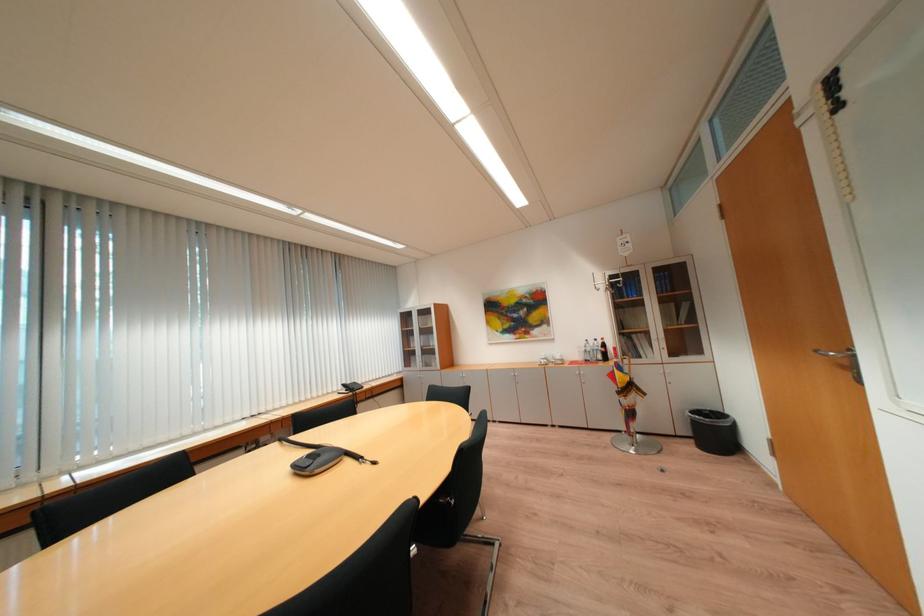
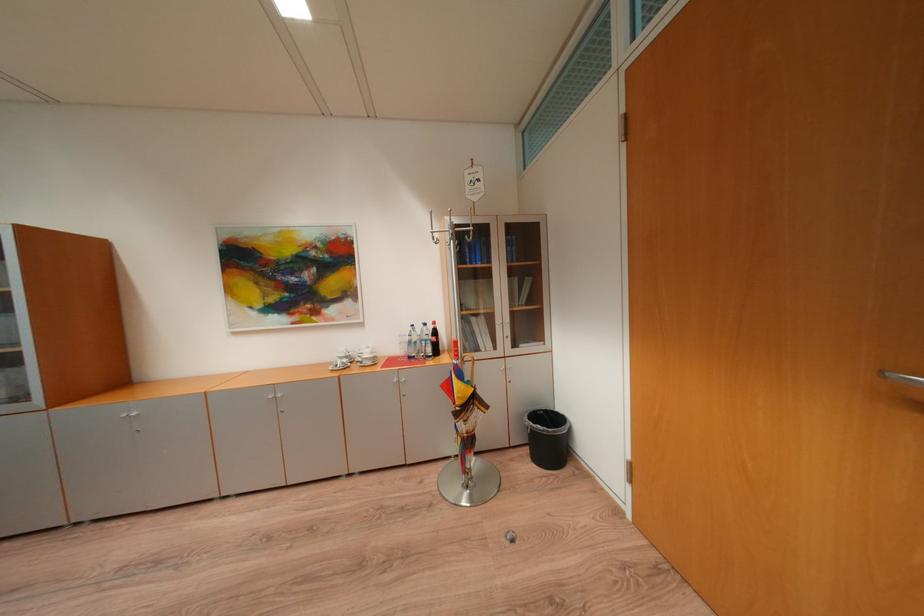
In the second image, find the point that corresponds to point 621,377 in the first image.

(456, 387)